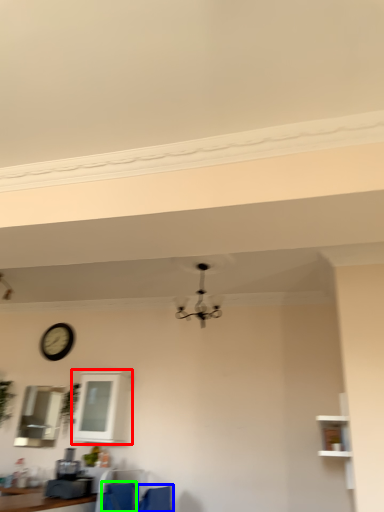
Question: Based on their relative distances, which object is farther from window (highlighted by a red box)? Choose from armchair (highlighted by a blue box) and feeding chair (highlighted by a green box).

Choices:
 (A) armchair
 (B) feeding chair

Answer: (A)